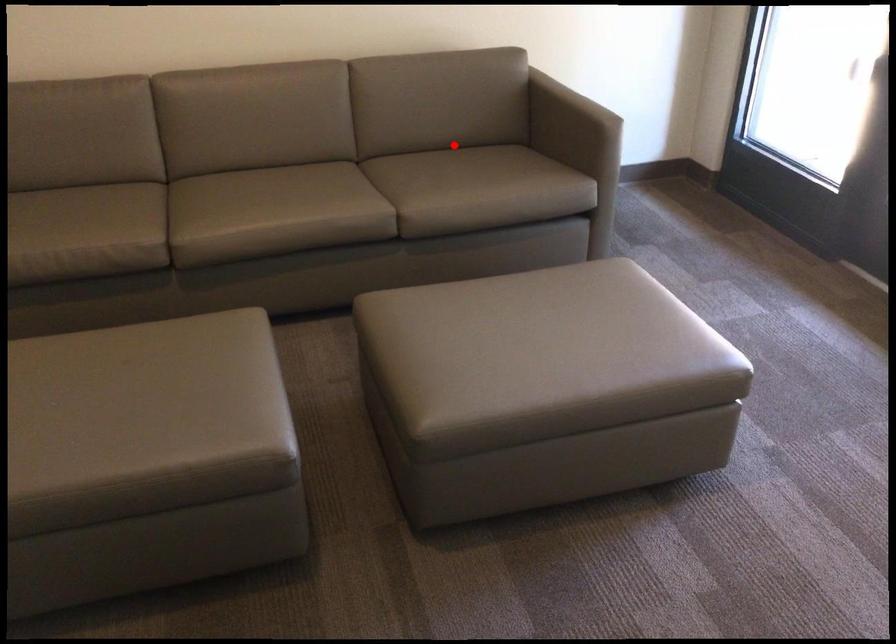
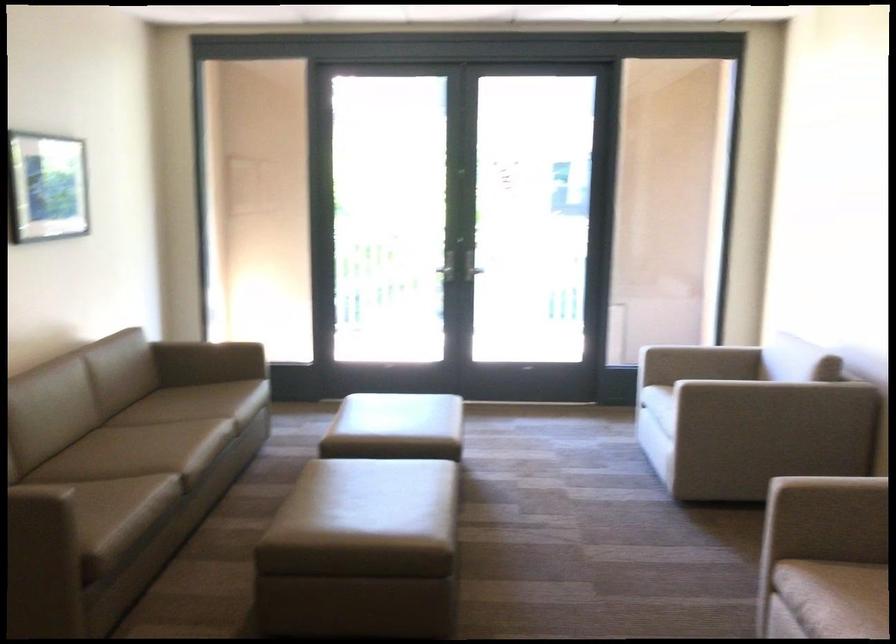
Question: I am providing you with two images of the same scene from different viewpoints. In image1, a red point is highlighted. Considering the same 3D point in image2, which of the following is correct?

Choices:
 (A) It is closer
 (B) It is farther

Answer: (B)